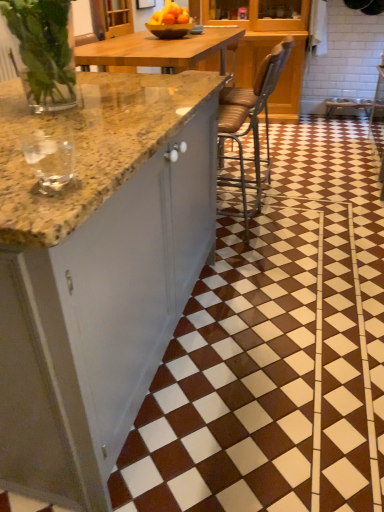
Question: Should I look upward or downward to see brown leather chair at center?

Choices:
 (A) up
 (B) down

Answer: (A)

Question: Is brown leather chair at center beside brown glossy tile at center?

Choices:
 (A) no
 (B) yes

Answer: (A)

Question: Could brown glossy tile at center be considered to be inside brown leather chair at center?

Choices:
 (A) yes
 (B) no

Answer: (B)

Question: Is the position of brown leather chair at center more distant than that of brown glossy tile at center?

Choices:
 (A) no
 (B) yes

Answer: (B)

Question: From the image's perspective, is brown leather chair at center located above brown glossy tile at center?

Choices:
 (A) no
 (B) yes

Answer: (B)

Question: Is brown leather chair at center smaller than brown glossy tile at center?

Choices:
 (A) no
 (B) yes

Answer: (B)

Question: Can you confirm if brown leather chair at center is taller than brown glossy tile at center?

Choices:
 (A) no
 (B) yes

Answer: (B)

Question: Does brown glossy tile at center have a lesser height compared to brown leather chair at center?

Choices:
 (A) no
 (B) yes

Answer: (B)

Question: From a real-world perspective, does brown glossy tile at center stand above brown leather chair at center?

Choices:
 (A) no
 (B) yes

Answer: (A)

Question: From the image's perspective, is brown glossy tile at center on top of brown leather chair at center?

Choices:
 (A) no
 (B) yes

Answer: (A)

Question: Is brown glossy tile at center further to camera compared to brown leather chair at center?

Choices:
 (A) no
 (B) yes

Answer: (A)

Question: Does brown glossy tile at center have a lesser width compared to brown leather chair at center?

Choices:
 (A) yes
 (B) no

Answer: (B)

Question: Could you tell me if brown glossy tile at center is turned towards brown leather chair at center?

Choices:
 (A) no
 (B) yes

Answer: (A)

Question: Considering the relative sizes of brown leather chair at center and clear glass wine glass at left in the image provided, is brown leather chair at center shorter than clear glass wine glass at left?

Choices:
 (A) no
 (B) yes

Answer: (A)